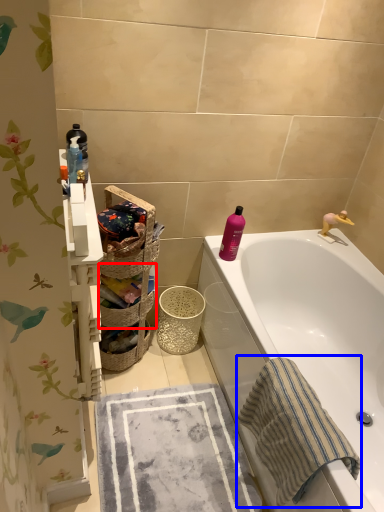
Question: Among these objects, which one is nearest to the camera, basket (highlighted by a red box) or beach towel (highlighted by a blue box)?

Choices:
 (A) basket
 (B) beach towel

Answer: (B)